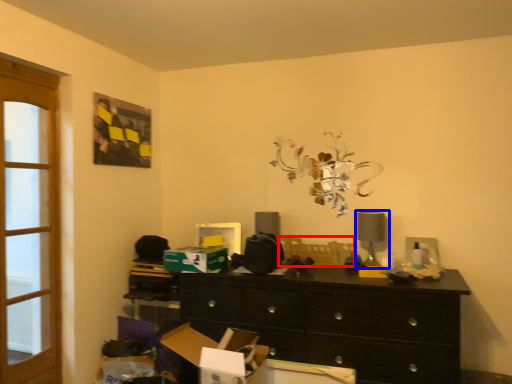
Question: Which of the following is the farthest to the observer, swivel chair (highlighted by a red box) or table lamp (highlighted by a blue box)?

Choices:
 (A) swivel chair
 (B) table lamp

Answer: (A)